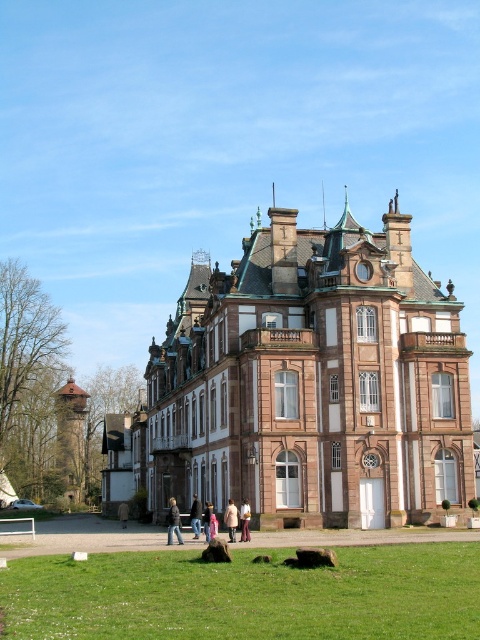
You are a guest at this historical building and notice two coats hanging on a rack in the entrance hall. The pink fabric coat at center and the light brown leather jacket at center. Which one is closer to you?

The pink fabric coat at center is closer to you since it is in front of the light brown leather jacket at center.

You are standing in front of the grand building and notice two points marked on its facade. The first point is at coordinates point [227,528] and the second at point [240,515]. Which of these two points is closer to your current position?

Point [227,528] is further to the camera than point [240,515], so the point closer to your position is point [240,515].

You are a guest at this historical building and see two coats hanging on a rack in the entrance hall. The pink fabric coat at center and the light brown leather jacket at center. Which one is positioned to the right side?

The pink fabric coat at center is positioned to the right of the light brown leather jacket at center.